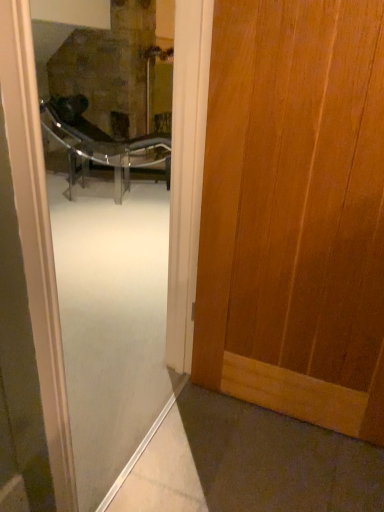
Where is `vacant space underneath transparent glass screen door at center (from a real-world perspective)`? vacant space underneath transparent glass screen door at center (from a real-world perspective) is located at coordinates (144, 430).